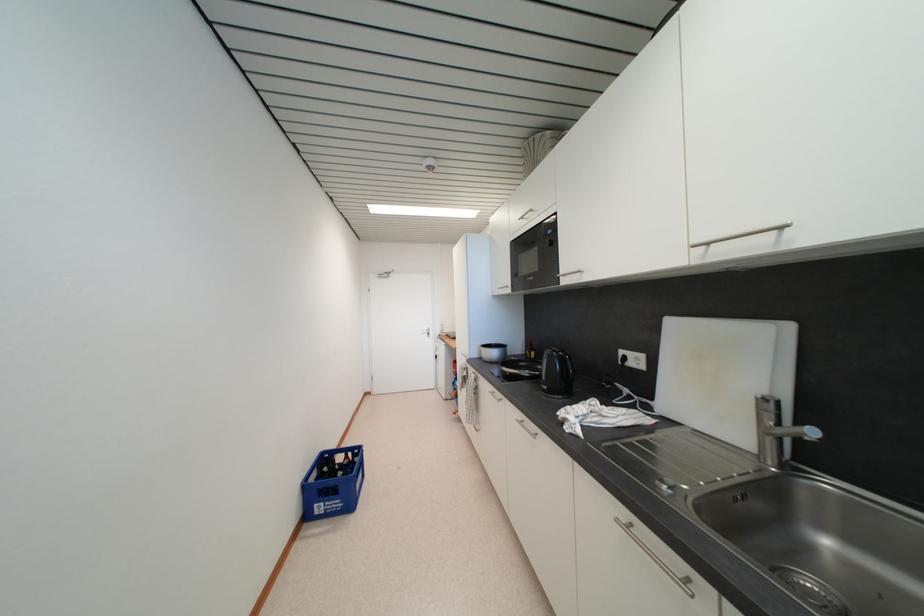
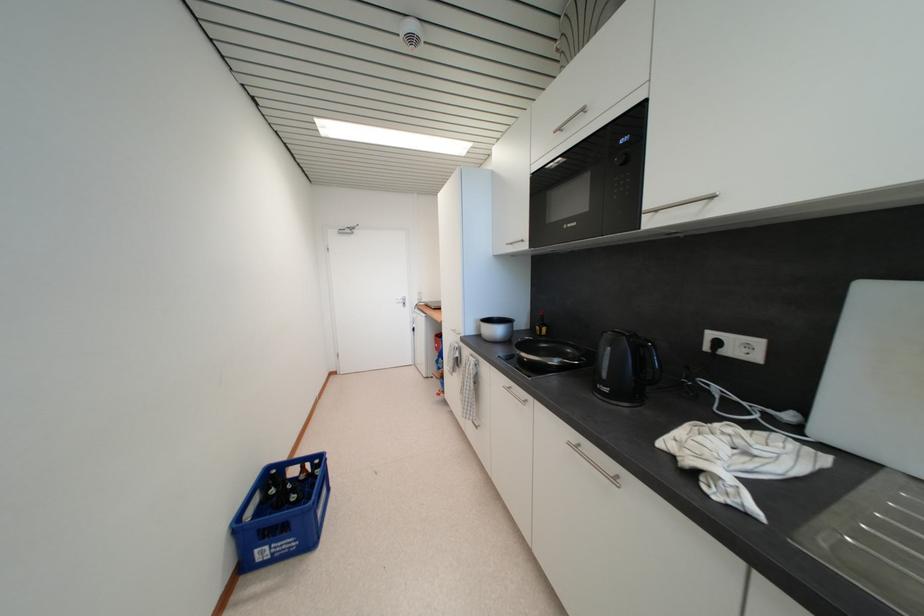
Question: Which direction would the cameraman need to move to produce the second image? Reply with the corresponding letter.

Choices:
 (A) Left
 (B) Right
 (C) Forward
 (D) Backward

Answer: (C)